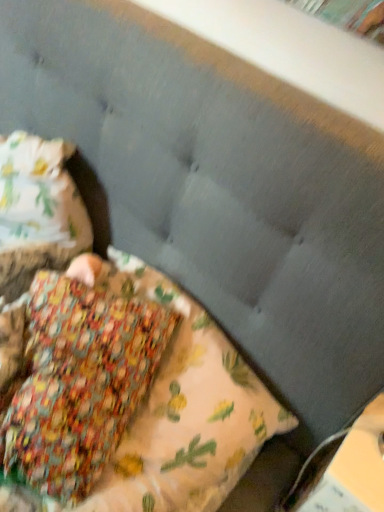
The image size is (384, 512). What do you see at coordinates (182, 419) in the screenshot?
I see `floral fabric pillow at center` at bounding box center [182, 419].

Identify the location of floral fabric pillow at center. Image resolution: width=384 pixels, height=512 pixels. (182, 419).

Identify the location of hardcover book at lower right. (354, 468).

Image resolution: width=384 pixels, height=512 pixels. What do you see at coordinates (354, 468) in the screenshot?
I see `hardcover book at lower right` at bounding box center [354, 468].

Where is `floral fabric pillow at center`? The width and height of the screenshot is (384, 512). floral fabric pillow at center is located at coordinates (182, 419).

Is floral fabric pillow at center to the left of hardcover book at lower right from the viewer's perspective?

Yes, floral fabric pillow at center is to the left of hardcover book at lower right.

Between floral fabric pillow at center and hardcover book at lower right, which one is positioned in front?

floral fabric pillow at center is in front.

Is point (99, 499) less distant than point (382, 442)?

That is True.

From the image's perspective, between floral fabric pillow at center and hardcover book at lower right, which one is located above?

From the image's view, floral fabric pillow at center is above.

From a real-world perspective, is floral fabric pillow at center physically located above or below hardcover book at lower right?

From a real-world perspective, floral fabric pillow at center is physically above hardcover book at lower right.

Based on the photo, considering the relative sizes of floral fabric pillow at center and hardcover book at lower right in the image provided, is floral fabric pillow at center thinner than hardcover book at lower right?

No.

Considering the sizes of objects floral fabric pillow at center and hardcover book at lower right in the image provided, who is shorter, floral fabric pillow at center or hardcover book at lower right?

floral fabric pillow at center is shorter.

Between floral fabric pillow at center and hardcover book at lower right, which one has smaller size?

hardcover book at lower right is smaller.

Is floral fabric pillow at center positioned beyond the bounds of hardcover book at lower right?

Yes, floral fabric pillow at center is located beyond the bounds of hardcover book at lower right.

Would you consider floral fabric pillow at center to be distant from hardcover book at lower right?

That's not correct — floral fabric pillow at center is a little close to hardcover book at lower right.

Is floral fabric pillow at center turned away from hardcover book at lower right?

No.

How different are the orientations of floral fabric pillow at center and hardcover book at lower right in degrees?

There is a 4.2-degree angle between the facing directions of floral fabric pillow at center and hardcover book at lower right.

Identify the location of paperback book below the floral fabric pillow at center (from a real-world perspective). Image resolution: width=384 pixels, height=512 pixels. (354, 468).

Which is more to the right, hardcover book at lower right or floral fabric pillow at center?

From the viewer's perspective, hardcover book at lower right appears more on the right side.

Is the position of hardcover book at lower right more distant than that of floral fabric pillow at center?

Yes, hardcover book at lower right is further from the camera.

Between point (353, 438) and point (142, 270), which one is positioned in front?

The point (353, 438) is closer.

From the image's perspective, relative to floral fabric pillow at center, is hardcover book at lower right above or below?

Based on their image positions, hardcover book at lower right is located beneath floral fabric pillow at center.

From a real-world perspective, is hardcover book at lower right located higher than floral fabric pillow at center?

No, from a real-world perspective, hardcover book at lower right is not above floral fabric pillow at center.

Considering the sizes of hardcover book at lower right and floral fabric pillow at center in the image, is hardcover book at lower right wider or thinner than floral fabric pillow at center?

Considering their sizes, hardcover book at lower right looks slimmer than floral fabric pillow at center.

Considering the sizes of objects hardcover book at lower right and floral fabric pillow at center in the image provided, who is shorter, hardcover book at lower right or floral fabric pillow at center?

floral fabric pillow at center is shorter.

Which of these two, hardcover book at lower right or floral fabric pillow at center, is smaller?

hardcover book at lower right.

Is hardcover book at lower right positioned beyond the bounds of floral fabric pillow at center?

Indeed, hardcover book at lower right is completely outside floral fabric pillow at center.

Is hardcover book at lower right beside floral fabric pillow at center?

hardcover book at lower right is not next to floral fabric pillow at center, and they're not touching.

Is hardcover book at lower right oriented away from floral fabric pillow at center?

No, hardcover book at lower right is not facing away from floral fabric pillow at center.

Can you tell me how much hardcover book at lower right and floral fabric pillow at center differ in facing direction?

The facing directions of hardcover book at lower right and floral fabric pillow at center are 4.2 degrees apart.

At what (x,y) coordinates should I click in order to perform the action: click on paperback book below the floral fabric pillow at center (from a real-world perspective). Please return your answer as a coordinate pair (x, y). Looking at the image, I should click on (354, 468).

Identify the location of pillow above the hardcover book at lower right (from the image's perspective). The width and height of the screenshot is (384, 512). (182, 419).

The width and height of the screenshot is (384, 512). Find the location of `paperback book below the floral fabric pillow at center (from a real-world perspective)`. paperback book below the floral fabric pillow at center (from a real-world perspective) is located at coordinates (354, 468).